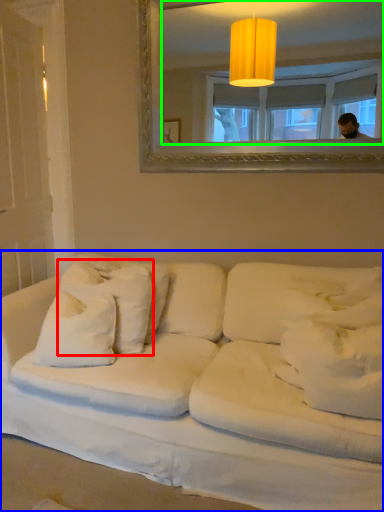
Question: Which object is positioned closest to pillow (highlighted by a red box)? Select from studio couch (highlighted by a blue box) and mirror (highlighted by a green box).

Choices:
 (A) studio couch
 (B) mirror

Answer: (A)